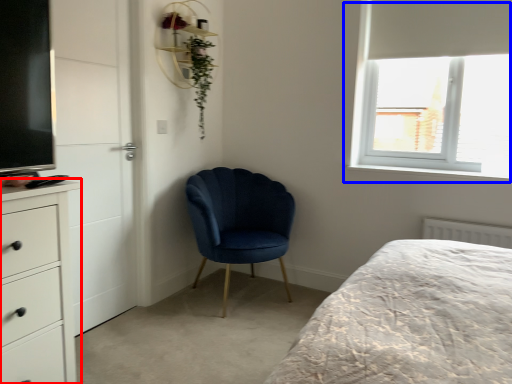
Question: Which object is further to the camera taking this photo, chest of drawers (highlighted by a red box) or window (highlighted by a blue box)?

Choices:
 (A) chest of drawers
 (B) window

Answer: (B)